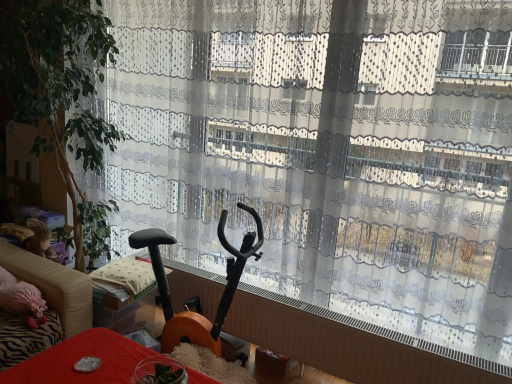
In order to face beige fabric couch at left, should I rotate leftwards or rightwards?

You should look left and rotate roughly 31.392 degrees.

Locate an element on the screen. This screenshot has height=384, width=512. black plastic exercise bike at left, which appears as the first furniture when viewed from the top is located at coordinates (124, 296).

Which is more to the right, wooden matte exercise bike at center or black plastic exercise bike at left, which is the 1th furniture from back to front?

wooden matte exercise bike at center.

Does point (221, 307) lie in front of point (141, 319)?

Yes.

Is wooden matte exercise bike at center not close to black plastic exercise bike at left, marked as the 2th furniture in a front-to-back arrangement?

wooden matte exercise bike at center is actually quite close to black plastic exercise bike at left, marked as the 2th furniture in a front-to-back arrangement.

Consider the image. Is black plastic exercise bike at left, marked as the 2th furniture in a front-to-back arrangement, positioned behind green leafy plant at left?

Yes, black plastic exercise bike at left, marked as the 2th furniture in a front-to-back arrangement, is further from the viewer.

Considering the sizes of objects black plastic exercise bike at left, which appears as the first furniture when viewed from the top, and green leafy plant at left in the image provided, who is wider, black plastic exercise bike at left, which appears as the first furniture when viewed from the top, or green leafy plant at left?

With larger width is green leafy plant at left.

In the scene shown: Is black plastic exercise bike at left, which is the 1th furniture from back to front, turned away from green leafy plant at left?

No.

Do you think wooden matte exercise bike at center is within beige fabric couch at left, or outside of it?

wooden matte exercise bike at center exists outside the volume of beige fabric couch at left.

Is point (165, 317) farther from viewer compared to point (22, 277)?

Yes, it is behind point (22, 277).

From the image's perspective, which one is positioned higher, wooden matte exercise bike at center or beige fabric couch at left?

wooden matte exercise bike at center.

Is wooden matte exercise bike at center next to beige fabric couch at left?

wooden matte exercise bike at center and beige fabric couch at left are not in contact.

Is black plastic exercise bike at left, which appears as the 2th furniture when ordered from the bottom, turned away from wooden matte exercise bike at center?

No.

Consider the image. Is black plastic exercise bike at left, which is the 1th furniture from back to front, shorter than wooden matte exercise bike at center?

Yes.

Looking at this image, can you confirm if black plastic exercise bike at left, which appears as the first furniture when viewed from the top, is bigger than wooden matte exercise bike at center?

No.

Is black plastic exercise bike at left, marked as the 2th furniture in a front-to-back arrangement, further to camera compared to wooden matte exercise bike at center?

Yes, black plastic exercise bike at left, marked as the 2th furniture in a front-to-back arrangement, is further from the viewer.

Between beige fabric couch at left and black plastic exercise bike at left, marked as the 2th furniture in a front-to-back arrangement, which one is positioned behind?

Positioned behind is black plastic exercise bike at left, marked as the 2th furniture in a front-to-back arrangement.

From the image's perspective, between beige fabric couch at left and black plastic exercise bike at left, which is the 1th furniture from back to front, which one is located above?

black plastic exercise bike at left, which is the 1th furniture from back to front.

Is beige fabric couch at left bigger than black plastic exercise bike at left, which appears as the first furniture when viewed from the top?

Yes, beige fabric couch at left is bigger than black plastic exercise bike at left, which appears as the first furniture when viewed from the top.

Identify the location of plant behind the wooden matte exercise bike at center. The width and height of the screenshot is (512, 384). (59, 83).

Would you say wooden matte exercise bike at center is a long distance from green leafy plant at left?

That's not correct — wooden matte exercise bike at center is a little close to green leafy plant at left.

From the image's perspective, is wooden matte exercise bike at center located above green leafy plant at left?

Incorrect, from the image's perspective, wooden matte exercise bike at center is lower than green leafy plant at left.

Could you tell me if beige fabric couch at left is facing translucent glass bowl at lower center, placed as the 2th furniture when sorted from top to bottom?

Yes, beige fabric couch at left is aimed at translucent glass bowl at lower center, placed as the 2th furniture when sorted from top to bottom.

Does beige fabric couch at left contain translucent glass bowl at lower center, the first furniture in the front-to-back sequence?

That's incorrect, translucent glass bowl at lower center, the first furniture in the front-to-back sequence, is not inside beige fabric couch at left.

Based on the photo, from the image's perspective, between beige fabric couch at left and translucent glass bowl at lower center, the first furniture in the front-to-back sequence, who is located below?

translucent glass bowl at lower center, the first furniture in the front-to-back sequence.

Locate an element on the screen. baby carriage in front of the black plastic exercise bike at left, which appears as the 2th furniture when ordered from the bottom is located at coordinates (223, 292).

From a real-world perspective, count 1st furnitures downward from the green leafy plant at left and point to it. Please provide its 2D coordinates.

[(124, 296)]

Looking at the image, which one is located closer to black plastic exercise bike at left, which appears as the 2th furniture when ordered from the bottom, wooden matte exercise bike at center or translucent glass bowl at lower center, placed as the 2th furniture when sorted from top to bottom?

wooden matte exercise bike at center is closer to black plastic exercise bike at left, which appears as the 2th furniture when ordered from the bottom.

From the image, which object appears to be nearer to translucent glass bowl at lower center, placed as the 2th furniture when sorted from top to bottom, wooden matte exercise bike at center or green leafy plant at left?

wooden matte exercise bike at center is positioned closer to the anchor translucent glass bowl at lower center, placed as the 2th furniture when sorted from top to bottom.

Looking at the image, which one is located further to black plastic exercise bike at left, which appears as the 2th furniture when ordered from the bottom, wooden matte exercise bike at center or beige fabric couch at left?

wooden matte exercise bike at center lies further to black plastic exercise bike at left, which appears as the 2th furniture when ordered from the bottom, than the other object.

Estimate the real-world distances between objects in this image. Which object is closer to translucent glass bowl at lower center, the first furniture in the front-to-back sequence, black plastic exercise bike at left, which is the 1th furniture from back to front, or wooden matte exercise bike at center?

black plastic exercise bike at left, which is the 1th furniture from back to front.

Which object lies nearer to the anchor point green leafy plant at left, wooden matte exercise bike at center or black plastic exercise bike at left, which appears as the first furniture when viewed from the top?

black plastic exercise bike at left, which appears as the first furniture when viewed from the top, is closer to green leafy plant at left.

From the image, which object appears to be nearer to beige fabric couch at left, translucent glass bowl at lower center, the first furniture in the front-to-back sequence, or black plastic exercise bike at left, which is the 1th furniture from back to front?

Among the two, black plastic exercise bike at left, which is the 1th furniture from back to front, is located nearer to beige fabric couch at left.

Which object lies nearer to the anchor point translucent glass bowl at lower center, the first furniture in the front-to-back sequence, beige fabric couch at left or wooden matte exercise bike at center?

Among the two, beige fabric couch at left is located nearer to translucent glass bowl at lower center, the first furniture in the front-to-back sequence.

Based on their spatial positions, is green leafy plant at left or wooden matte exercise bike at center further from black plastic exercise bike at left, which appears as the first furniture when viewed from the top?

green leafy plant at left lies further to black plastic exercise bike at left, which appears as the first furniture when viewed from the top, than the other object.

The height and width of the screenshot is (384, 512). Find the location of `baby carriage between green leafy plant at left and translucent glass bowl at lower center, the first furniture in the front-to-back sequence, from top to bottom`. baby carriage between green leafy plant at left and translucent glass bowl at lower center, the first furniture in the front-to-back sequence, from top to bottom is located at coordinates (223, 292).

Where is `studio couch that lies between green leafy plant at left and translucent glass bowl at lower center, the 2th furniture when ordered from back to front, from top to bottom`? This screenshot has height=384, width=512. studio couch that lies between green leafy plant at left and translucent glass bowl at lower center, the 2th furniture when ordered from back to front, from top to bottom is located at coordinates (47, 305).

The width and height of the screenshot is (512, 384). I want to click on furniture between green leafy plant at left and translucent glass bowl at lower center, acting as the first furniture starting from the bottom, from top to bottom, so click(124, 296).

Where is `studio couch between translucent glass bowl at lower center, placed as the 2th furniture when sorted from top to bottom, and black plastic exercise bike at left, which is the 1th furniture from back to front, in the front-back direction`? The height and width of the screenshot is (384, 512). studio couch between translucent glass bowl at lower center, placed as the 2th furniture when sorted from top to bottom, and black plastic exercise bike at left, which is the 1th furniture from back to front, in the front-back direction is located at coordinates (47, 305).